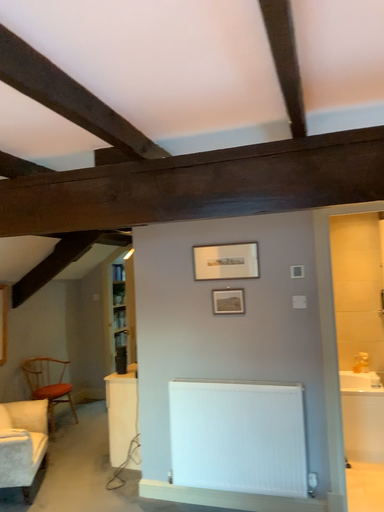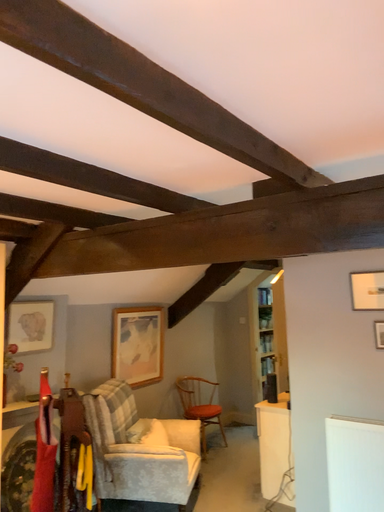
Question: How did the camera likely rotate when shooting the video?

Choices:
 (A) rotated left
 (B) rotated right

Answer: (A)